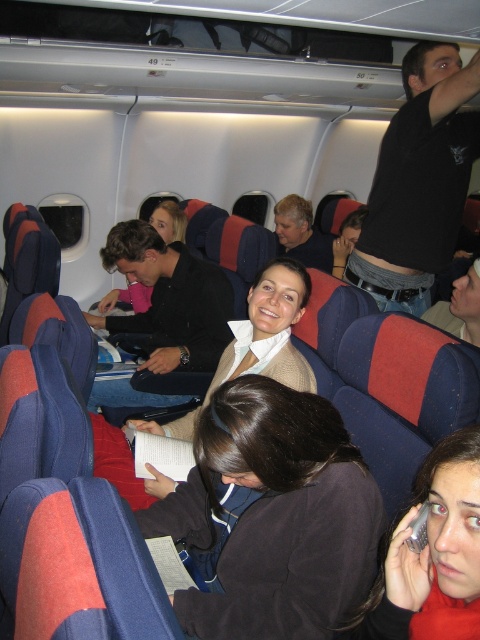
You are a passenger sitting in the airplane cabin and want to take a photo of both point (x=442, y=209) and point (x=192, y=260). Which point should you focus on first to ensure both are in the frame?

You should focus on point (x=442, y=209) first because it is closer to the camera than point (x=192, y=260), so adjusting the focus from near to far will help both points be in the frame.

You are a flight attendant checking seat belts. You see the black cotton shirt at upper center and the matte black jacket at center. Which one is narrower in width?

The black cotton shirt at upper center is thinner than the matte black jacket at center, so the black cotton shirt at upper center is narrower in width.

You are a flight attendant checking the cabin. You need to locate the dark brown fabric at center. According to the coordinates provided, where would you find it?

The dark brown fabric at center is located at coordinates point (274, 515).